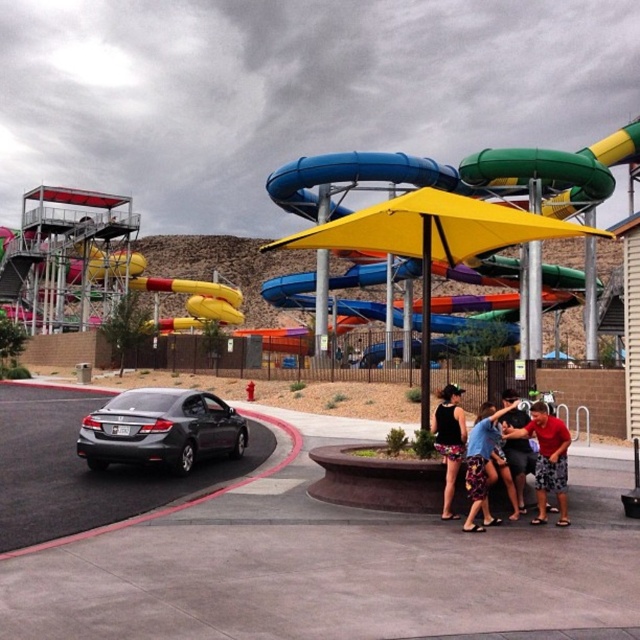
You are at the water park and see a person wearing a red cotton shirt at lower right and a floral skirt at lower center. Which clothing item is positioned more to the east in the image?

The red cotton shirt at lower right is positioned to the right of the floral skirt at lower center, so it is more to the east in the image.

You are a photographer at the water park and need to capture both the floral skirt at lower center and the black matte dress at center in a single frame. Given their sizes, which one might require you to adjust your camera angle to ensure it fits properly in the shot?

The floral skirt at lower center has a larger width than the black matte dress at center, so you might need to adjust your camera angle to accommodate its wider size to ensure it fits properly in the shot.